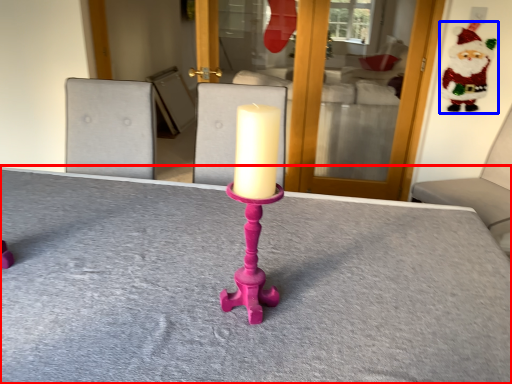
Question: Which point is further to the camera, table (highlighted by a red box) or santa claus (highlighted by a blue box)?

Choices:
 (A) table
 (B) santa claus

Answer: (B)